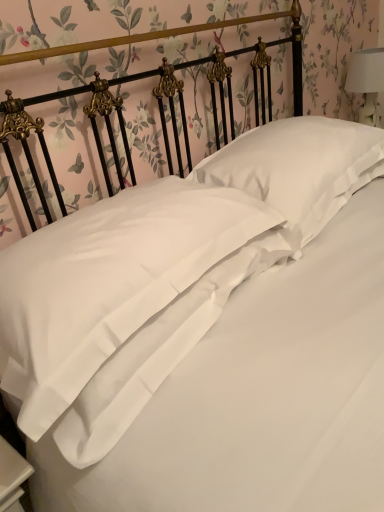
Question: From a real-world perspective, is white satin pillow at center, the 2th pillow positioned from the left, physically located above or below white fabric lampshade at upper right?

Choices:
 (A) above
 (B) below

Answer: (B)

Question: In the image, is white satin pillow at center, the 2th pillow positioned from the left, positioned in front of or behind white fabric lampshade at upper right?

Choices:
 (A) behind
 (B) front

Answer: (B)

Question: Based on their relative distances, which object is nearer to the white fabric lampshade at upper right?

Choices:
 (A) white satin pillow at center, which is the first pillow in right-to-left order
 (B) satin white pillow at center, marked as the second pillow in a right-to-left arrangement

Answer: (A)

Question: Estimate the real-world distances between objects in this image. Which object is farther from the satin white pillow at center, marked as the second pillow in a right-to-left arrangement?

Choices:
 (A) white fabric lampshade at upper right
 (B) white satin pillow at center, the 2th pillow positioned from the left

Answer: (A)